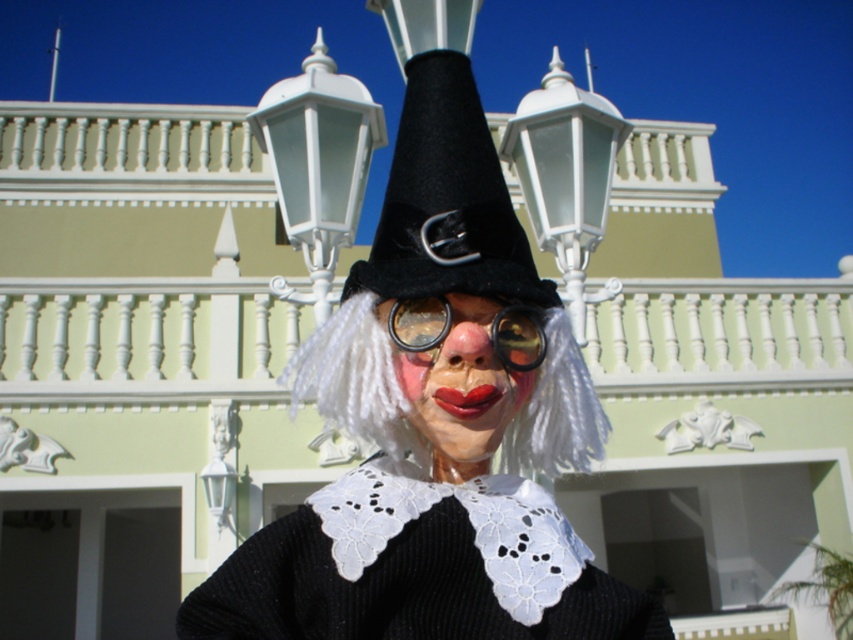
Identify the location of white glossy lamp post at upper center. (566, 176).

Can you confirm if white glossy lamp post at upper center is taller than shiny black goggles at center?

Yes, white glossy lamp post at upper center is taller than shiny black goggles at center.

Identify the location of white glossy lamp post at upper center. The height and width of the screenshot is (640, 853). (566, 176).

This screenshot has height=640, width=853. I want to click on white glossy lamp post at upper center, so click(x=566, y=176).

Does matte black witch hat at center appear on the right side of white glossy lamp post at upper center?

Incorrect, matte black witch hat at center is not on the right side of white glossy lamp post at upper center.

Locate an element on the screen. The image size is (853, 640). matte black witch hat at center is located at coordinates (434, 433).

This screenshot has height=640, width=853. Identify the location of matte black witch hat at center. (434, 433).

Is matte plastic clown face at center bigger than pink matte nose at center?

Indeed, matte plastic clown face at center has a larger size compared to pink matte nose at center.

In the scene shown: Measure the distance from matte plastic clown face at center to pink matte nose at center.

The distance of matte plastic clown face at center from pink matte nose at center is 4.12 inches.

What do you see at coordinates (465, 372) in the screenshot? I see `matte plastic clown face at center` at bounding box center [465, 372].

Where is `matte plastic clown face at center`? This screenshot has height=640, width=853. matte plastic clown face at center is located at coordinates (465, 372).